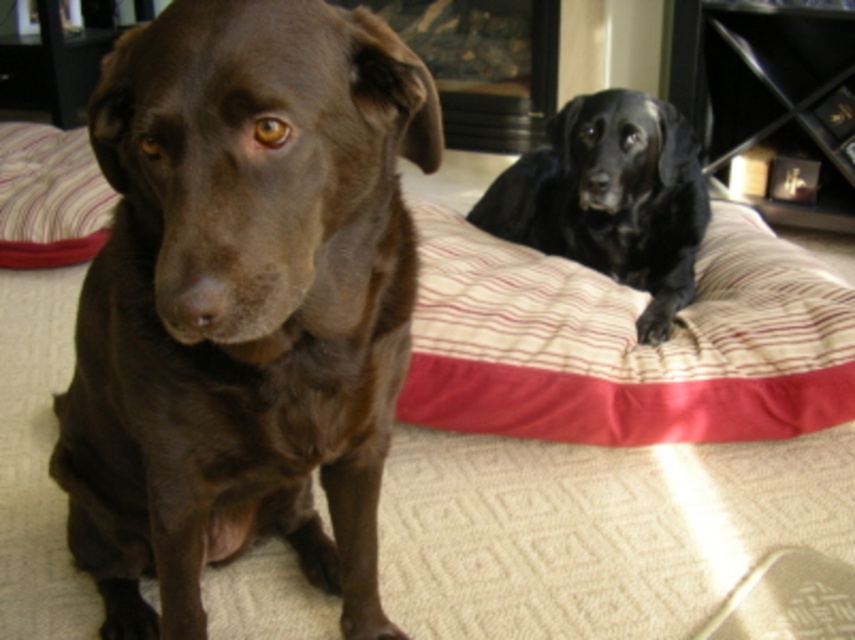
Question: Which of the following is the farthest from the observer?

Choices:
 (A) (493, 198)
 (B) (620, 304)
 (C) (45, 138)
 (D) (396, 253)

Answer: (C)

Question: Estimate the real-world distances between objects in this image. Which object is farther from the striped fabric dog bed at right?

Choices:
 (A) shiny brown dog at center
 (B) black glossy dog at upper right
 (C) striped fabric pillow at left

Answer: (C)

Question: Does striped fabric dog bed at right appear under striped fabric pillow at left?

Choices:
 (A) yes
 (B) no

Answer: (A)

Question: Does shiny brown dog at center have a larger size compared to striped fabric dog bed at right?

Choices:
 (A) no
 (B) yes

Answer: (A)

Question: Is shiny brown dog at center wider than striped fabric dog bed at right?

Choices:
 (A) no
 (B) yes

Answer: (A)

Question: Among these objects, which one is nearest to the camera?

Choices:
 (A) striped fabric dog bed at right
 (B) black glossy dog at upper right
 (C) striped fabric pillow at left

Answer: (A)